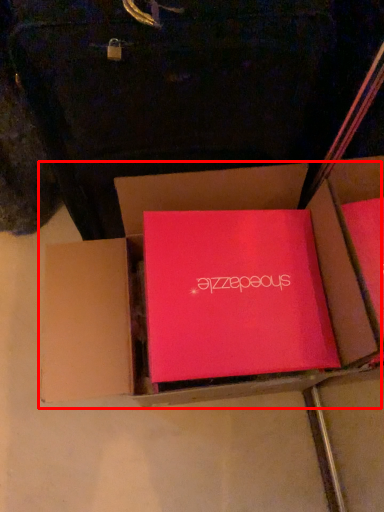
Question: Where is box (annotated by the red box) located in relation to box in the image?

Choices:
 (A) right
 (B) left

Answer: (B)